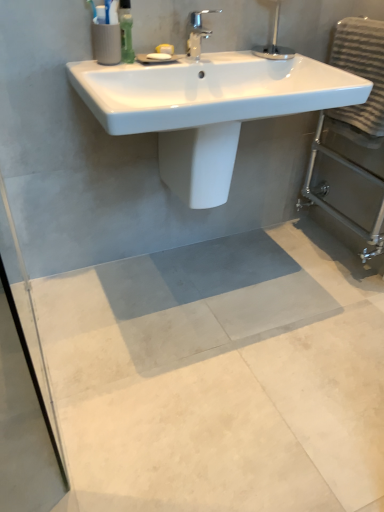
Measure the distance between point (174,131) and camera.

Answer: A distance of 4.62 feet exists between point (174,131) and camera.

What is the approximate height of white glossy bidet at center?

white glossy bidet at center is 11.82 inches tall.

At what (x,y) coordinates should I click in order to perform the action: click on gray concrete mat at center. Please return your answer as a coordinate pair (x, y). This screenshot has width=384, height=512. Looking at the image, I should click on (220, 376).

What is the approximate height of gray textured towel at right?

It is 15.39 inches.

The image size is (384, 512). Describe the element at coordinates (361, 69) in the screenshot. I see `gray textured towel at right` at that location.

At what (x,y) coordinates should I click in order to perform the action: click on white glossy sink at upper center. Please return your answer as a coordinate pair (x, y). Looking at the image, I should click on (210, 91).

This screenshot has height=512, width=384. In order to click on white glossy bidet at center in this screenshot , I will do `click(199, 162)`.

Can you confirm if white glossy sink at upper center is bigger than gray textured towel at right?

Indeed, white glossy sink at upper center has a larger size compared to gray textured towel at right.

Choose the correct answer: Is white glossy sink at upper center inside gray textured towel at right or outside it?

white glossy sink at upper center is located beyond the bounds of gray textured towel at right.

Considering the positions of objects white glossy sink at upper center and gray textured towel at right in the image provided, who is more to the left, white glossy sink at upper center or gray textured towel at right?

From the viewer's perspective, white glossy sink at upper center appears more on the left side.

Where is `hand towel on the right of white glossy sink at upper center`? The height and width of the screenshot is (512, 384). hand towel on the right of white glossy sink at upper center is located at coordinates (361, 69).

From the image's perspective, is white glossy sink at upper center over gray concrete mat at center?

Correct, white glossy sink at upper center appears higher than gray concrete mat at center in the image.

Could gray concrete mat at center be considered to be inside white glossy sink at upper center?

No, white glossy sink at upper center does not contain gray concrete mat at center.

In order to click on concrete below the white glossy sink at upper center (from the image's perspective) in this screenshot , I will do `click(220, 376)`.

Looking at this image, is white glossy sink at upper center wider than gray concrete mat at center?

No.

Can you confirm if gray concrete mat at center is positioned to the left of white glossy sink at upper center?

In fact, gray concrete mat at center is to the right of white glossy sink at upper center.

Does gray concrete mat at center touch white glossy sink at upper center?

No, gray concrete mat at center is not beside white glossy sink at upper center.

Which object is further away from the camera, gray concrete mat at center or white glossy sink at upper center?

Positioned behind is white glossy sink at upper center.

How much distance is there between gray concrete mat at center and white glossy sink at upper center?

gray concrete mat at center is 30.53 inches away from white glossy sink at upper center.

From the image's perspective, which one is positioned lower, gray textured towel at right or white glossy bidet at center?

white glossy bidet at center, from the image's perspective.

Could you tell me if gray textured towel at right is turned towards white glossy bidet at center?

Yes, gray textured towel at right is oriented towards white glossy bidet at center.

Looking at their sizes, would you say gray textured towel at right is wider or thinner than white glossy bidet at center?

gray textured towel at right is thinner than white glossy bidet at center.

Looking at this image, can you confirm if gray textured towel at right is positioned to the left of white glossy bidet at center?

In fact, gray textured towel at right is to the right of white glossy bidet at center.

Is white glossy sink at upper center taller or shorter than chrome metallic faucet at upper center?

white glossy sink at upper center is shorter than chrome metallic faucet at upper center.

Looking at their sizes, would you say white glossy sink at upper center is wider or thinner than chrome metallic faucet at upper center?

Considering their sizes, white glossy sink at upper center looks broader than chrome metallic faucet at upper center.

Which is behind, white glossy sink at upper center or chrome metallic faucet at upper center?

chrome metallic faucet at upper center is more distant.

From a real-world perspective, is white glossy sink at upper center on chrome metallic faucet at upper center?

Incorrect, from a real-world perspective, white glossy sink at upper center is lower than chrome metallic faucet at upper center.

From their relative heights in the image, would you say gray textured towel at right is taller or shorter than gray concrete mat at center?

gray textured towel at right is taller than gray concrete mat at center.

Does gray textured towel at right have a larger size compared to gray concrete mat at center?

Incorrect, gray textured towel at right is not larger than gray concrete mat at center.

In the image, there is a chrome metallic faucet at upper center. Identify the location of concrete below it (from the image's perspective). 220,376.

In the scene shown: From the image's perspective, is gray concrete mat at center on top of chrome metallic faucet at upper center?

Actually, gray concrete mat at center appears below chrome metallic faucet at upper center in the image.

Relative to chrome metallic faucet at upper center, is gray concrete mat at center in front or behind?

gray concrete mat at center is in front of chrome metallic faucet at upper center.

Identify the location of counter top in front of the gray textured towel at right. The width and height of the screenshot is (384, 512). (210, 91).

Where is `counter top positioned vertically above the gray concrete mat at center (from a real-world perspective)`? This screenshot has height=512, width=384. counter top positioned vertically above the gray concrete mat at center (from a real-world perspective) is located at coordinates (210, 91).

When comparing their distances from gray concrete mat at center, does gray textured towel at right or chrome metallic faucet at upper center seem closer?

Based on the image, gray textured towel at right appears to be nearer to gray concrete mat at center.

Estimate the real-world distances between objects in this image. Which object is closer to gray concrete mat at center, gray textured towel at right or white glossy bidet at center?

white glossy bidet at center is closer to gray concrete mat at center.

Estimate the real-world distances between objects in this image. Which object is further from gray concrete mat at center, white glossy sink at upper center or gray textured towel at right?

Among the two, gray textured towel at right is located further to gray concrete mat at center.

Considering their positions, is gray concrete mat at center positioned closer to gray textured towel at right than white glossy bidet at center?

white glossy bidet at center lies closer to gray textured towel at right than the other object.

From the image, which object appears to be farther from white glossy sink at upper center, gray concrete mat at center or white glossy bidet at center?

Among the two, gray concrete mat at center is located further to white glossy sink at upper center.

Which object lies further to the anchor point chrome metallic faucet at upper center, gray textured towel at right or white glossy bidet at center?

The object further to chrome metallic faucet at upper center is gray textured towel at right.

When comparing their distances from gray concrete mat at center, does white glossy bidet at center or chrome metallic faucet at upper center seem further?

Among the two, chrome metallic faucet at upper center is located further to gray concrete mat at center.

Estimate the real-world distances between objects in this image. Which object is further from white glossy bidet at center, gray textured towel at right or gray concrete mat at center?

gray concrete mat at center.

The height and width of the screenshot is (512, 384). Find the location of `counter top between chrome metallic faucet at upper center and gray concrete mat at center in the up-down direction`. counter top between chrome metallic faucet at upper center and gray concrete mat at center in the up-down direction is located at coordinates (210, 91).

You are a GUI agent. You are given a task and a screenshot of the screen. Output one action in this format:
    pyautogui.click(x=<x>, y=<y>)
    Task: Click on the counter top between chrome metallic faucet at upper center and white glossy bidet at center from top to bottom
    Image resolution: width=384 pixels, height=512 pixels.
    Given the screenshot: What is the action you would take?
    click(210, 91)

Locate an element on the screen. This screenshot has width=384, height=512. hand towel between chrome metallic faucet at upper center and gray concrete mat at center in the up-down direction is located at coordinates (361, 69).

You are a GUI agent. You are given a task and a screenshot of the screen. Output one action in this format:
    pyautogui.click(x=<x>, y=<y>)
    Task: Click on the counter top located between chrome metallic faucet at upper center and gray textured towel at right in the left-right direction
    This screenshot has width=384, height=512.
    Given the screenshot: What is the action you would take?
    pyautogui.click(x=210, y=91)